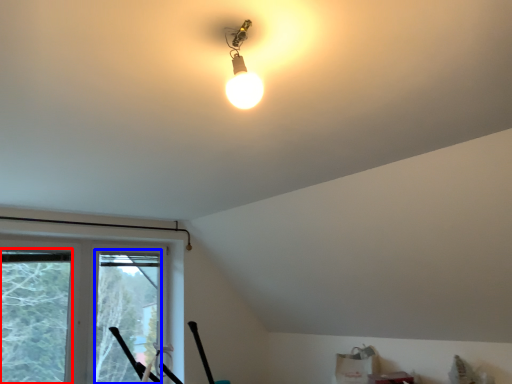
Question: Which of the following is the closest to the observer, window screen (highlighted by a red box) or window screen (highlighted by a blue box)?

Choices:
 (A) window screen
 (B) window screen

Answer: (A)